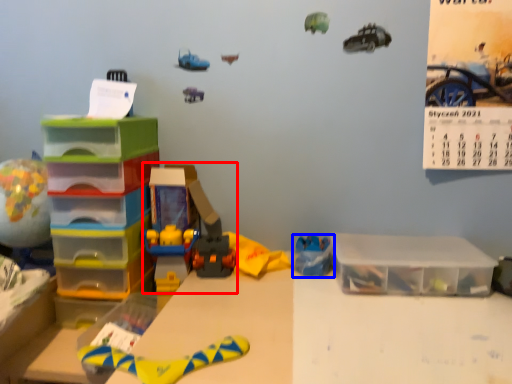
Question: Which object appears closest to the camera in this image, toy (highlighted by a red box) or toy (highlighted by a blue box)?

Choices:
 (A) toy
 (B) toy

Answer: (A)